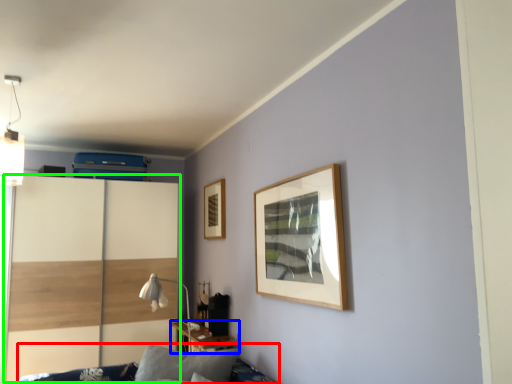
Question: Estimate the real-world distances between objects in this image. Which object is closer to furniture (highlighted by a red box), table (highlighted by a blue box) or dresser (highlighted by a green box)?

Choices:
 (A) table
 (B) dresser

Answer: (A)